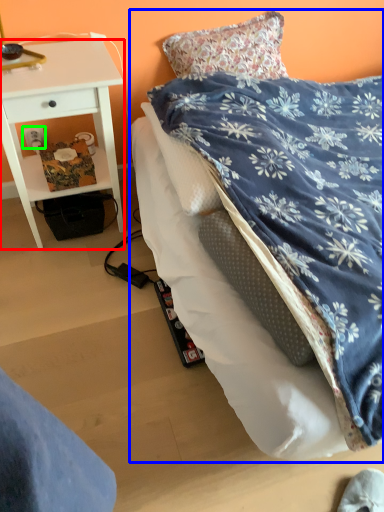
Question: Which object is positioned closest to desk (highlighted by a red box)? Select from bed (highlighted by a blue box) and power outlet (highlighted by a green box).

Choices:
 (A) bed
 (B) power outlet

Answer: (B)